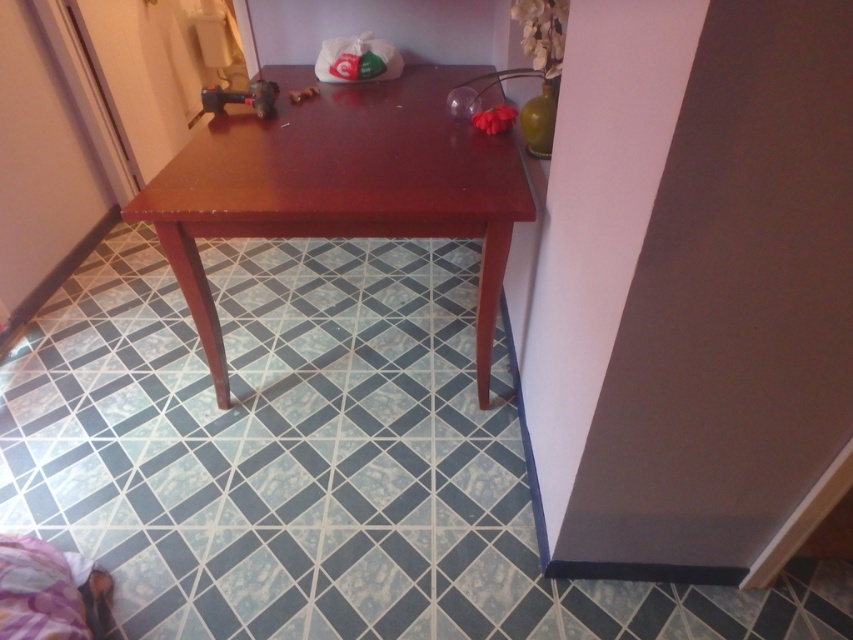
You are trying to place a new decorative item on the table. The item requires a space of 25 inches between the transparent glass lamp at upper center and the metallic plastic toy at center. Is there enough space available?

The transparent glass lamp at upper center and metallic plastic toy at center are 25.43 inches apart, which is more than the required 25 inches, so there is enough space available.

You are standing in the room and want to place a new decorative item on the matte wood table at center. However, you notice the transparent glass lamp at upper center. Where should you position the item so it won not be blocked by the lamp?

You should position the item on the matte wood table at center away from the area directly under the transparent glass lamp at upper center to avoid obstruction.

You are standing in the room and want to place a small object on the table. You have two options for placement based on coordinates provided. Which coordinate point, point (544,118) or point (311,92), is closer to you when looking directly at the table?

Point (544,118) is in front of point (311,92), so it is closer to you when looking directly at the table.